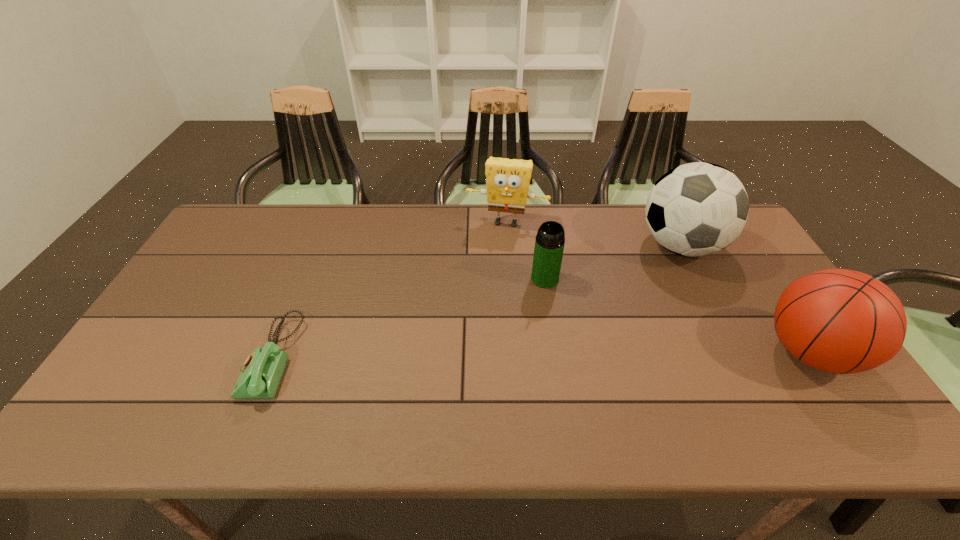
The width and height of the screenshot is (960, 540). What are the coordinates of `the leftmost object` in the screenshot? It's located at (262, 370).

Find the location of a particular element. Image resolution: width=960 pixels, height=540 pixels. telephone is located at coordinates (262, 370).

Where is `basketball`? The width and height of the screenshot is (960, 540). basketball is located at coordinates (840, 321).

Locate an element on the screen. The width and height of the screenshot is (960, 540). sponge is located at coordinates 507,180.

Locate an element on the screen. thermos bottle is located at coordinates (549, 244).

This screenshot has height=540, width=960. Identify the location of soccer ball. (696, 209).

Image resolution: width=960 pixels, height=540 pixels. I want to click on vacant space situated 0.300m on the dial of the telephone, so click(133, 357).

In order to click on free region located on the dial of the telephone in this screenshot , I will do `click(157, 357)`.

Image resolution: width=960 pixels, height=540 pixels. What are the coordinates of `vacant space located on the dial of the telephone` in the screenshot? It's located at (165, 357).

This screenshot has height=540, width=960. Identify the location of vacant area situated on the back of the basketball. (741, 248).